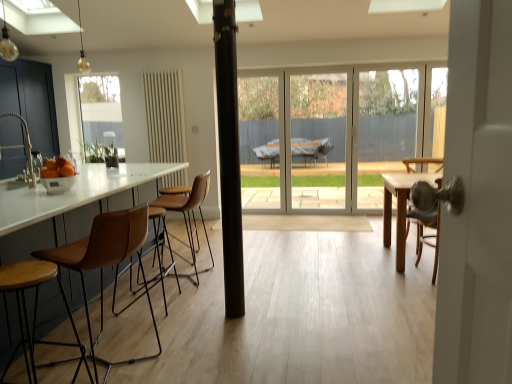
Question: Does orange matte bowl at left have a greater height compared to black matte pole at center?

Choices:
 (A) yes
 (B) no

Answer: (B)

Question: Is orange matte bowl at left shorter than black matte pole at center?

Choices:
 (A) no
 (B) yes

Answer: (B)

Question: Is the depth of orange matte bowl at left less than that of black matte pole at center?

Choices:
 (A) yes
 (B) no

Answer: (B)

Question: Is orange matte bowl at left not close to black matte pole at center?

Choices:
 (A) no
 (B) yes

Answer: (B)

Question: Is black matte pole at center located within orange matte bowl at left?

Choices:
 (A) no
 (B) yes

Answer: (A)

Question: From the image's perspective, is matte silver faucet at left positioned above or below matte glass bulb at upper left, the second light fixture in the back-to-front sequence?

Choices:
 (A) below
 (B) above

Answer: (A)

Question: Considering the positions of matte silver faucet at left and matte glass bulb at upper left, which ranks as the 1th light fixture in left-to-right order, in the image, is matte silver faucet at left bigger or smaller than matte glass bulb at upper left, which ranks as the 1th light fixture in left-to-right order,?

Choices:
 (A) small
 (B) big

Answer: (B)

Question: From a real-world perspective, is matte silver faucet at left positioned above or below matte glass bulb at upper left, placed as the 2th light fixture when sorted from right to left?

Choices:
 (A) below
 (B) above

Answer: (A)

Question: Is matte silver faucet at left inside the boundaries of matte glass bulb at upper left, positioned as the 1th light fixture in front-to-back order, or outside?

Choices:
 (A) inside
 (B) outside

Answer: (B)

Question: Would you say matte gold bulb at upper left, positioned as the first light fixture in right-to-left order, is to the left or to the right of transparent glass door at center in the picture?

Choices:
 (A) left
 (B) right

Answer: (A)

Question: From a real-world perspective, is matte gold bulb at upper left, positioned as the first light fixture in right-to-left order, physically located above or below transparent glass door at center?

Choices:
 (A) below
 (B) above

Answer: (B)

Question: From the image's perspective, relative to transparent glass door at center, is matte gold bulb at upper left, acting as the second light fixture starting from the front, above or below?

Choices:
 (A) above
 (B) below

Answer: (A)

Question: Is point (82, 54) closer or farther from the camera than point (343, 177)?

Choices:
 (A) closer
 (B) farther

Answer: (B)

Question: Is transparent glass door at center situated inside matte gold bulb at upper left, the second light fixture when ordered from left to right, or outside?

Choices:
 (A) inside
 (B) outside

Answer: (B)

Question: Based on their positions, is transparent glass door at center located to the left or right of matte gold bulb at upper left, positioned as the first light fixture in right-to-left order?

Choices:
 (A) left
 (B) right

Answer: (B)